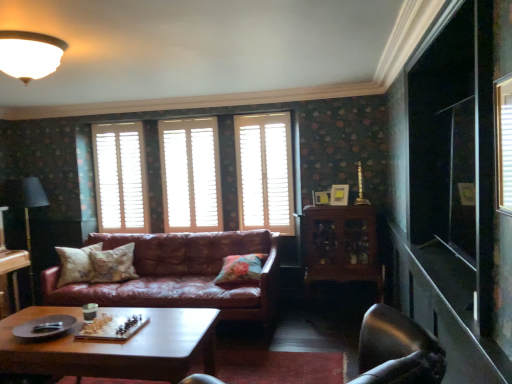
This screenshot has width=512, height=384. Describe the element at coordinates (180, 274) in the screenshot. I see `leather couch at center` at that location.

Measure the distance between point (x=268, y=146) and camera.

15.38 feet.

What do you see at coordinates (113, 327) in the screenshot? I see `wooden chess set at center` at bounding box center [113, 327].

Describe the element at coordinates (113, 264) in the screenshot. I see `fluffy beige pillow at center, marked as the second pillow in a right-to-left arrangement` at that location.

At what (x,y) coordinates should I click in order to perform the action: click on white wooden shutters at center, which is the third window in right-to-left order. Please return your answer as a coordinate pair (x, y). The height and width of the screenshot is (384, 512). Looking at the image, I should click on (120, 178).

At what (x,y) coordinates should I click in order to perform the action: click on leather couch at center. Please return your answer as a coordinate pair (x, y). The width and height of the screenshot is (512, 384). Looking at the image, I should click on (180, 274).

From a real-world perspective, is matte white picture frame at center, positioned as the 2th picture frame in right-to-left order, located higher than leather couch at center?

Yes.

Considering the relative sizes of matte white picture frame at center, positioned as the 2th picture frame in right-to-left order, and leather couch at center in the image provided, is matte white picture frame at center, positioned as the 2th picture frame in right-to-left order, shorter than leather couch at center?

Yes.

Looking at this image, from the image's perspective, which object appears higher, matte white picture frame at center, the first picture frame positioned from the left, or leather couch at center?

matte white picture frame at center, the first picture frame positioned from the left.

Can you tell me how much floral fabric pillow at center, positioned as the first pillow in right-to-left order, and shiny brown wood coffee table at center differ in facing direction?

The angular difference between floral fabric pillow at center, positioned as the first pillow in right-to-left order, and shiny brown wood coffee table at center is 1.49 degrees.

Does floral fabric pillow at center, positioned as the first pillow in right-to-left order, have a greater height compared to shiny brown wood coffee table at center?

No, floral fabric pillow at center, positioned as the first pillow in right-to-left order, is not taller than shiny brown wood coffee table at center.

From the image's perspective, is floral fabric pillow at center, positioned as the first pillow in right-to-left order, on top of shiny brown wood coffee table at center?

Yes, from the image's perspective, floral fabric pillow at center, positioned as the first pillow in right-to-left order, is on top of shiny brown wood coffee table at center.

Which point is more forward, (413, 159) or (30, 254)?

Positioned in front is point (413, 159).

Is transparent glass door at right oriented towards black fabric lamp at left?

Yes, transparent glass door at right faces towards black fabric lamp at left.

Considering the relative sizes of transparent glass door at right and black fabric lamp at left in the image provided, is transparent glass door at right smaller than black fabric lamp at left?

Yes, transparent glass door at right is smaller than black fabric lamp at left.

From a real-world perspective, who is located higher, wooden chess set at center or shiny brown wood coffee table at center?

In real-world perspective, wooden chess set at center is above.

From the image's perspective, is wooden chess set at center above or below shiny brown wood coffee table at center?

A: Clearly, from the image's perspective, wooden chess set at center is above shiny brown wood coffee table at center.

In the image, is wooden chess set at center positioned in front of or behind shiny brown wood coffee table at center?

In the image, wooden chess set at center appears behind shiny brown wood coffee table at center.

Does metallic silver swivel chair at lower right appear on the left side of black fabric lamp at left?

In fact, metallic silver swivel chair at lower right is to the right of black fabric lamp at left.

Between point (442, 367) and point (21, 185), which one is positioned behind?

The point (21, 185) is more distant.

Which is correct: metallic silver swivel chair at lower right is inside black fabric lamp at left, or outside of it?

metallic silver swivel chair at lower right is located beyond the bounds of black fabric lamp at left.

Which object is thinner, matte white picture frame at center, the first picture frame positioned from the left, or shiny brown wood coffee table at center?

matte white picture frame at center, the first picture frame positioned from the left, is thinner.

From the picture: Could you tell me if matte white picture frame at center, the first picture frame positioned from the left, is turned towards shiny brown wood coffee table at center?

No, matte white picture frame at center, the first picture frame positioned from the left, is not oriented towards shiny brown wood coffee table at center.

Locate an element on the screen. This screenshot has width=512, height=384. coffee table that appears on the left of matte white picture frame at center, the first picture frame positioned from the left is located at coordinates (115, 345).

Who is taller, matte white picture frame at center, positioned as the 2th picture frame in right-to-left order, or shiny brown wood coffee table at center?

shiny brown wood coffee table at center.

In order to click on the 2nd window behind the white wooden shutters at center, arranged as the 3th window when viewed from the left in this screenshot , I will do `click(120, 178)`.

Which of these two, white wooden shutters at center, which is the third window in right-to-left order, or white wooden shutters at center, placed as the first window when sorted from right to left, is bigger?

white wooden shutters at center, placed as the first window when sorted from right to left.

Is white wooden shutters at center, which is the third window in right-to-left order, spatially inside white wooden shutters at center, arranged as the 3th window when viewed from the left, or outside of it?

white wooden shutters at center, which is the third window in right-to-left order, is not inside white wooden shutters at center, arranged as the 3th window when viewed from the left, it's outside.

From a real-world perspective, does white wooden shutters at center, the first window in the left-to-right sequence, stand above white wooden shutters at center, placed as the first window when sorted from right to left?

Yes.

At what (x,y) coordinates should I click in order to perform the action: click on picture frame that is the 1st one when counting rightward from the leather couch at center. Please return your answer as a coordinate pair (x, y). This screenshot has width=512, height=384. Looking at the image, I should click on (322, 197).

Locate an element on the screen. The width and height of the screenshot is (512, 384). the 1st pillow behind the shiny brown wood coffee table at center, starting your count from the anchor is located at coordinates (241, 269).

Based on their spatial positions, is wooden chess set at center or matte white ceiling light at upper left closer to white wooden shutters at center, the first window in the left-to-right sequence?

The object closer to white wooden shutters at center, the first window in the left-to-right sequence, is wooden chess set at center.

Looking at the image, which one is located closer to black fabric lamp at left, leather couch at center or floral fabric pillow at center, acting as the 3th pillow starting from the right?

Among the two, floral fabric pillow at center, acting as the 3th pillow starting from the right, is located nearer to black fabric lamp at left.

Looking at this image, when comparing their distances from white wood blinds at center, acting as the 2th window starting from the right, does metallic silver swivel chair at lower right or matte white picture frame at center, the first picture frame positioned from the left, seem further?

metallic silver swivel chair at lower right lies further to white wood blinds at center, acting as the 2th window starting from the right, than the other object.

In the scene shown: When comparing their distances from matte white ceiling light at upper left, does shiny brown wood coffee table at center or matte white picture frame at center, the first picture frame positioned from the left, seem further?

matte white picture frame at center, the first picture frame positioned from the left, is positioned further to the anchor matte white ceiling light at upper left.

From the image, which object appears to be nearer to black fabric lamp at left, matte white ceiling light at upper left or white wood blinds at center, which is the 2th window in left-to-right order?

white wood blinds at center, which is the 2th window in left-to-right order.

Estimate the real-world distances between objects in this image. Which object is closer to floral fabric pillow at center, arranged as the first pillow when viewed from the left, metallic silver swivel chair at lower right or transparent glass door at right?

Among the two, transparent glass door at right is located nearer to floral fabric pillow at center, arranged as the first pillow when viewed from the left.

Based on their spatial positions, is white wooden shutters at center, placed as the first window when sorted from right to left, or fluffy beige pillow at center, the 2th pillow from the left, further from floral fabric pillow at center, arranged as the 3th pillow when viewed from the left?

fluffy beige pillow at center, the 2th pillow from the left, is further to floral fabric pillow at center, arranged as the 3th pillow when viewed from the left.

Estimate the real-world distances between objects in this image. Which object is further from matte white picture frame at center, positioned as the 2th picture frame in right-to-left order, fluffy beige pillow at center, the 2th pillow from the left, or leather couch at center?

fluffy beige pillow at center, the 2th pillow from the left.

This screenshot has width=512, height=384. What are the coordinates of `board game between shiny brown wood coffee table at center and white wooden shutters at center, arranged as the 3th window when viewed from the left, along the z-axis` in the screenshot? It's located at (113, 327).

Locate an element on the screen. This screenshot has width=512, height=384. board game between black fabric lamp at left and matte gold picture frame at upper center, which is the second picture frame from left to right, from left to right is located at coordinates (x=113, y=327).

This screenshot has width=512, height=384. In order to click on coffee table between black fabric lamp at left and matte gold picture frame at upper center, which is the second picture frame from left to right, from left to right in this screenshot , I will do `click(115, 345)`.

This screenshot has height=384, width=512. I want to click on board game between transparent glass door at right and floral fabric pillow at center, arranged as the 3th pillow when viewed from the left, in the front-back direction, so click(113, 327).